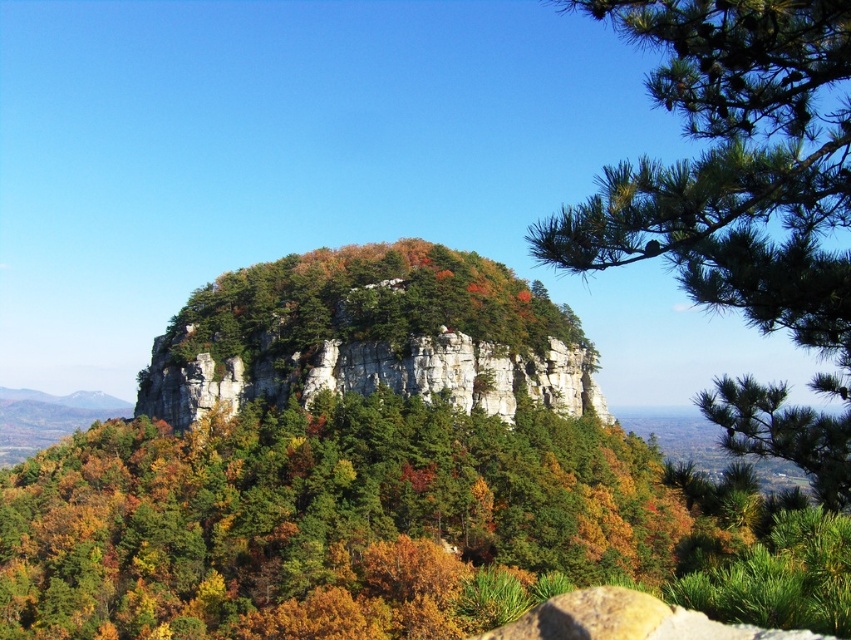
Question: Which point is closer to the camera taking this photo?

Choices:
 (A) (437, 621)
 (B) (415, 324)

Answer: (A)

Question: Is green needle-like branches at upper right to the right of rocky cliff at center from the viewer's perspective?

Choices:
 (A) yes
 (B) no

Answer: (A)

Question: Is green matte tree at center below rocky cliff at center?

Choices:
 (A) yes
 (B) no

Answer: (A)

Question: Which object is the closest to the rocky cliff at center?

Choices:
 (A) green needle-like branches at upper right
 (B) green matte tree at center

Answer: (B)

Question: Does green matte tree at center have a lesser width compared to rocky cliff at center?

Choices:
 (A) no
 (B) yes

Answer: (A)

Question: Which point is farther to the camera?

Choices:
 (A) (715, 124)
 (B) (563, 333)

Answer: (B)